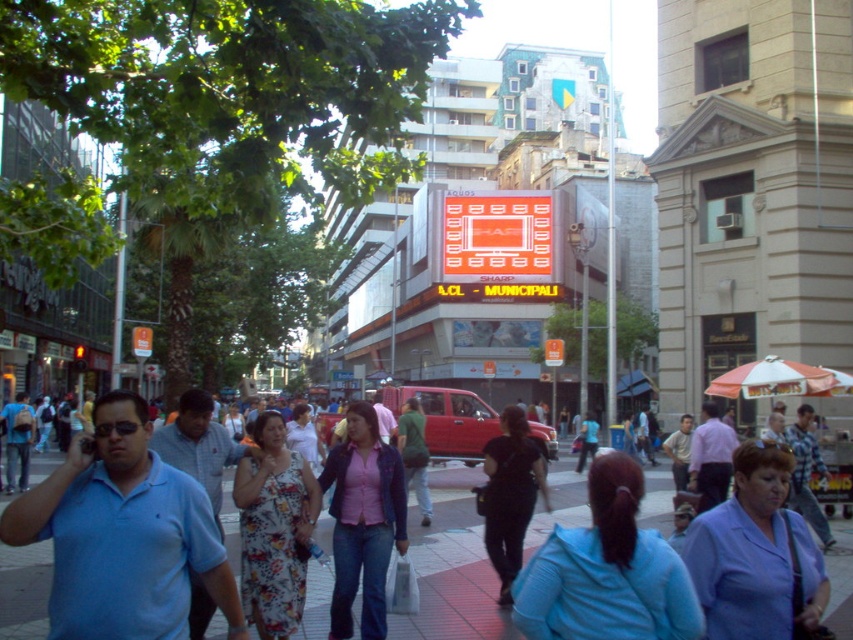
Is point (154, 625) less distant than point (410, 536)?

Yes.

Measure the distance between blue cotton polo shirt at left and camera.

blue cotton polo shirt at left is 8.95 meters from camera.

Identify the location of blue cotton polo shirt at left. Image resolution: width=853 pixels, height=640 pixels. (123, 534).